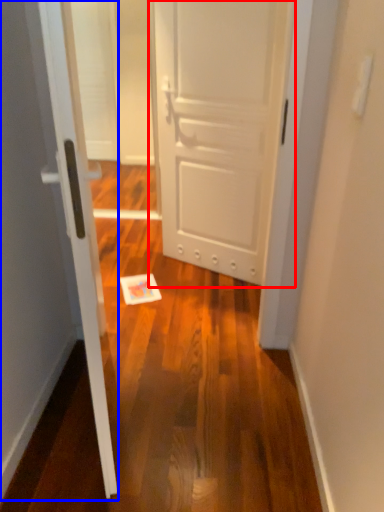
Question: Which point is further to the camera, door (highlighted by a red box) or door (highlighted by a blue box)?

Choices:
 (A) door
 (B) door

Answer: (A)